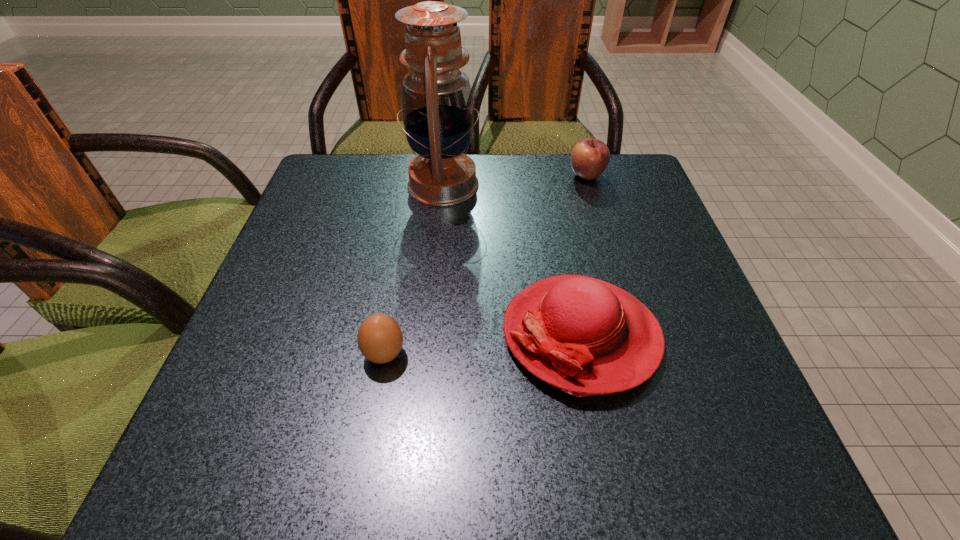
Image resolution: width=960 pixels, height=540 pixels. What are the coordinates of `oil lamp that is positioned at the far edge` in the screenshot? It's located at (437, 108).

Where is `apple present at the far edge`? This screenshot has height=540, width=960. apple present at the far edge is located at coordinates (589, 158).

You are a GUI agent. You are given a task and a screenshot of the screen. Output one action in this format:
    pyautogui.click(x=<x>, y=<y>)
    Task: Click on the apple positioned at the right edge
    This screenshot has height=540, width=960.
    Given the screenshot: What is the action you would take?
    pyautogui.click(x=589, y=158)

Identify the location of hat that is at the right edge. (582, 335).

Identify the location of object that is at the far right corner. (589, 158).

Identify the location of free location at the far edge of the desktop. The image size is (960, 540). (386, 169).

Where is `free region at the near edge`? The width and height of the screenshot is (960, 540). free region at the near edge is located at coordinates (580, 462).

This screenshot has width=960, height=540. Find the location of `free space at the left edge`. free space at the left edge is located at coordinates (372, 213).

Locate an element on the screen. vacant space at the far right corner of the desktop is located at coordinates (605, 193).

Find the location of a particular element. vacant point located between the hat and the apple is located at coordinates point(584,255).